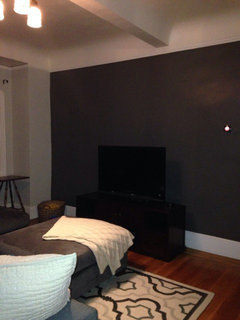
This screenshot has width=240, height=320. I want to click on tv, so click(139, 181), click(115, 180).